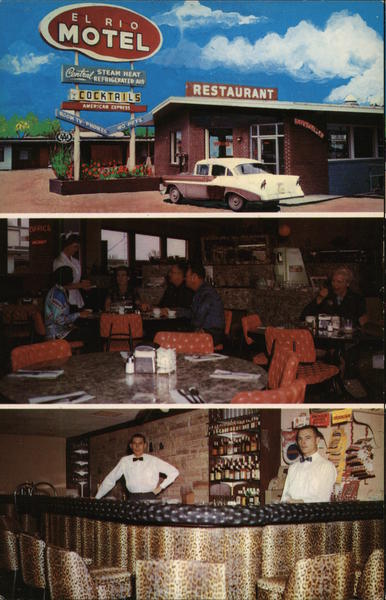
The image size is (386, 600). I want to click on orange chairs, so click(x=57, y=350), click(x=112, y=321), click(x=190, y=345), click(x=299, y=344), click(x=284, y=364), click(x=252, y=318), click(x=230, y=316).